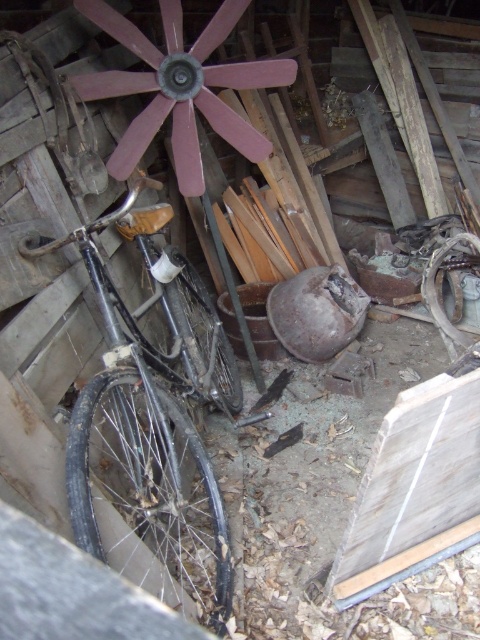
Is black matte bicycle at left thinner than rusty metal wagon wheel at center?

Incorrect, black matte bicycle at left's width is not less than rusty metal wagon wheel at center's.

Which is behind, point (111, 323) or point (204, 308)?

Point (204, 308)

At what (x,y) coordinates should I click in order to perform the action: click on black matte bicycle at left. Please return your answer as a coordinate pair (x, y). The image size is (480, 640). Looking at the image, I should click on (148, 429).

Does black matte bicycle at left have a greater width compared to rustic metal wagon wheel at center?

Yes, black matte bicycle at left is wider than rustic metal wagon wheel at center.

Is point (108, 417) positioned after point (98, 445)?

No, (108, 417) is in front of (98, 445).

Image resolution: width=480 pixels, height=640 pixels. Identify the location of black matte bicycle at left. (148, 429).

Can you confirm if rustic metal wagon wheel at center is shorter than rusty metal wagon wheel at center?

No.

Who is shorter, rustic metal wagon wheel at center or rusty metal wagon wheel at center?

rusty metal wagon wheel at center

Who is more distant from viewer, (157,506) or (196,364)?

Point (196,364)

Where is `rustic metal wagon wheel at center`? Image resolution: width=480 pixels, height=640 pixels. rustic metal wagon wheel at center is located at coordinates (151, 484).